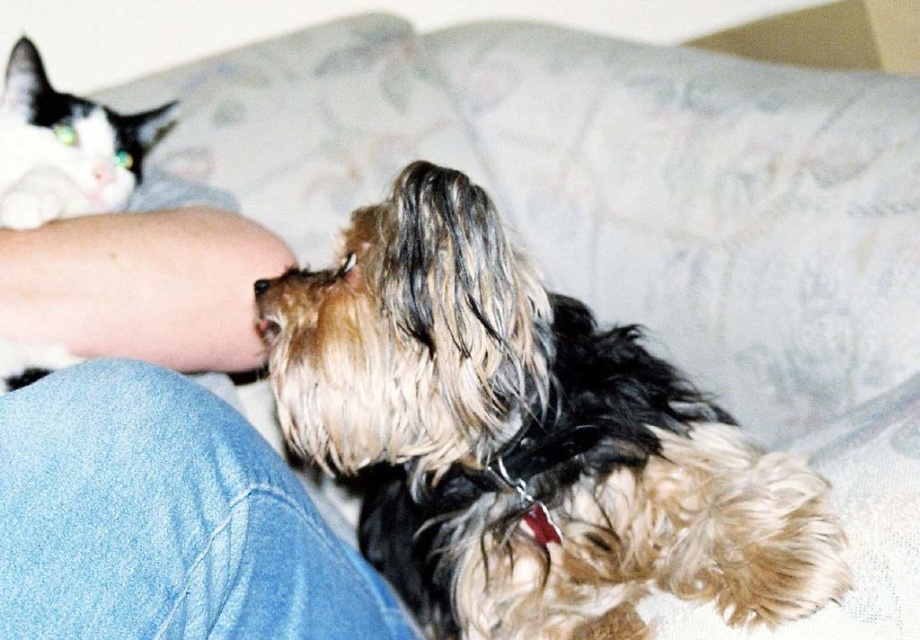
Question: Which point is farther to the camera?

Choices:
 (A) (361, 257)
 (B) (35, 250)
 (C) (88, 180)

Answer: (C)

Question: Which of the following is the closest to the observer?

Choices:
 (A) blue denim jeans at lower left
 (B) white glossy cat nose at upper left

Answer: (A)

Question: In this image, where is white fur at upper left located relative to white glossy cat nose at upper left?

Choices:
 (A) above
 (B) below

Answer: (A)

Question: Which of the following is the closest to the observer?

Choices:
 (A) fuzzy fur dog at center
 (B) white fur at upper left

Answer: (A)

Question: Can you confirm if fuzzy fur dog at center is positioned above white glossy cat nose at upper left?

Choices:
 (A) yes
 (B) no

Answer: (B)

Question: Does blue denim jeans at lower left appear on the right side of white fur at upper left?

Choices:
 (A) no
 (B) yes

Answer: (B)